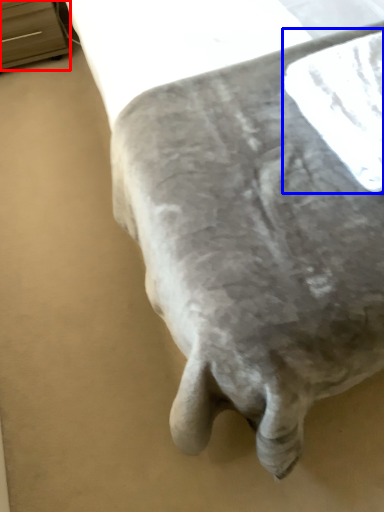
Question: Which object appears closest to the camera in this image, furniture (highlighted by a red box) or linen (highlighted by a blue box)?

Choices:
 (A) furniture
 (B) linen

Answer: (B)